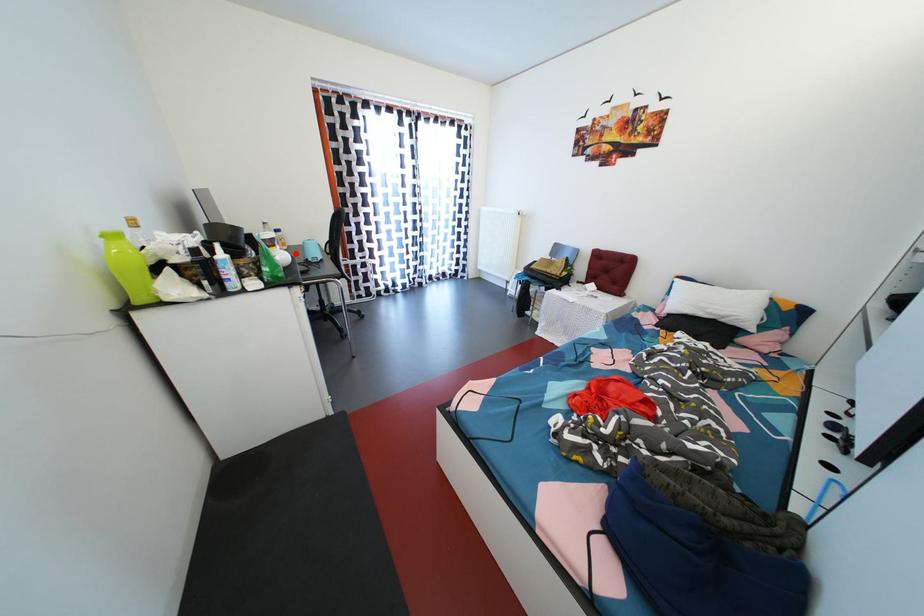
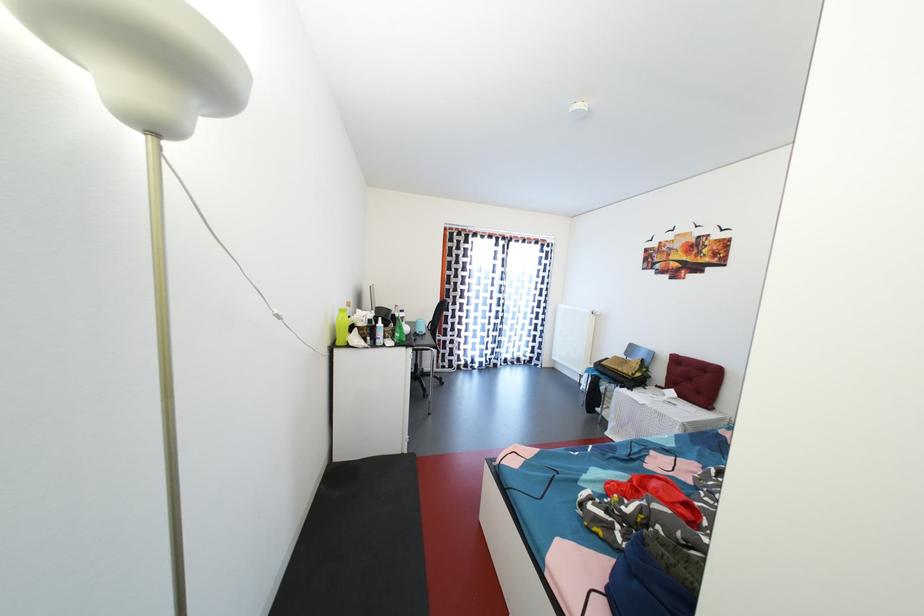
Question: A red point is marked in image1. In image2, is the corresponding 3D point closer to the camera or farther? Reply with the corresponding letter.

Choices:
 (A) The corresponding 3D point is closer.
 (B) The corresponding 3D point is farther.

Answer: (B)